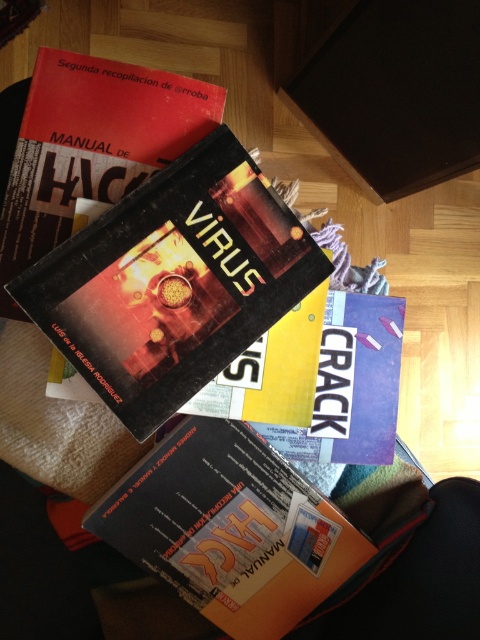
Describe the element at coordinates (172, 282) in the screenshot. This screenshot has width=480, height=640. I see `shiny metallic book at center` at that location.

The height and width of the screenshot is (640, 480). I want to click on shiny metallic book at center, so click(x=172, y=282).

Does orange matte manual at center lie in front of matte black book at upper left?

No.

This screenshot has width=480, height=640. Describe the element at coordinates (230, 529) in the screenshot. I see `orange matte manual at center` at that location.

Which is in front, point (245, 554) or point (49, 99)?

Positioned in front is point (49, 99).

Where is `orange matte manual at center`? orange matte manual at center is located at coordinates (230, 529).

Is matte black book at upper left positioned behind metallic blue book at center?

No, matte black book at upper left is in front of metallic blue book at center.

Which of these two, matte black book at upper left or metallic blue book at center, stands taller?

Standing taller between the two is matte black book at upper left.

Image resolution: width=480 pixels, height=640 pixels. Identify the location of matte black book at upper left. (91, 147).